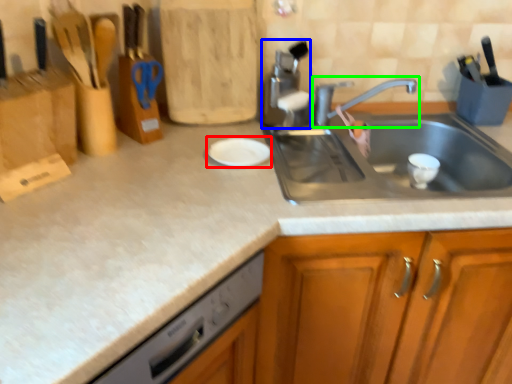
Question: Which object is positioned closest to plate (highlighted by a red box)? Select from appliance (highlighted by a blue box) and tap (highlighted by a green box).

Choices:
 (A) appliance
 (B) tap

Answer: (A)